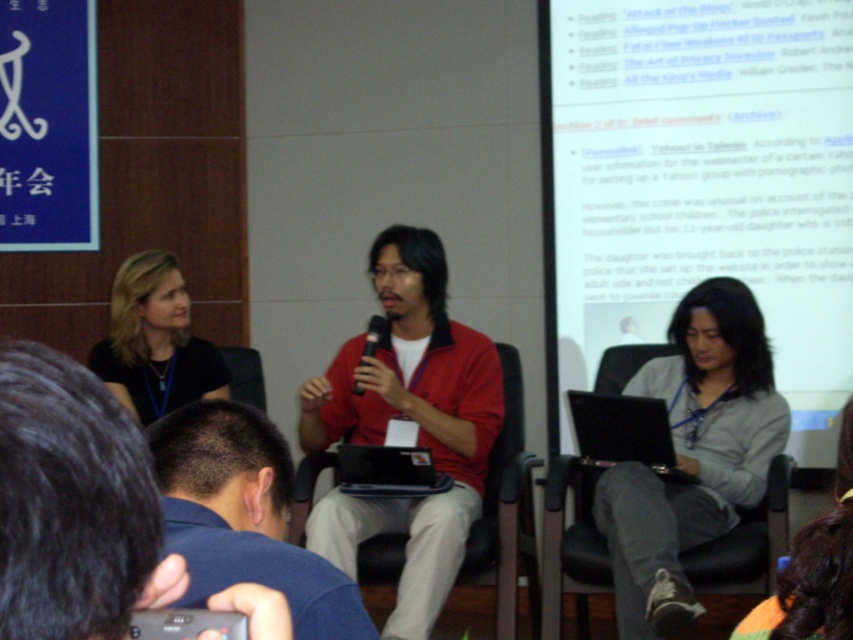
Which is in front, point (479, 496) or point (415, 468)?

Point (415, 468)

Which is below, matte red jacket at center or black plastic laptop at center?

Positioned lower is black plastic laptop at center.

Which is behind, point (485, 339) or point (351, 444)?

Point (485, 339)

The width and height of the screenshot is (853, 640). What are the coordinates of `matte red jacket at center` in the screenshot? It's located at (408, 422).

In the scene shown: Who is positioned more to the left, gray fabric jacket at lower right or black matte microphone at center?

black matte microphone at center

The width and height of the screenshot is (853, 640). I want to click on gray fabric jacket at lower right, so click(x=814, y=568).

Locate an element on the screen. This screenshot has height=640, width=853. gray fabric jacket at lower right is located at coordinates (814, 568).

Does black fabric shirt at left have a larger size compared to black matte microphone at center?

Correct, black fabric shirt at left is larger in size than black matte microphone at center.

Does black fabric shirt at left appear over black matte microphone at center?

Indeed, black fabric shirt at left is positioned over black matte microphone at center.

The width and height of the screenshot is (853, 640). What are the coordinates of `black fabric shirt at left` in the screenshot? It's located at (154, 340).

Locate an element on the screen. black fabric shirt at left is located at coordinates (154, 340).